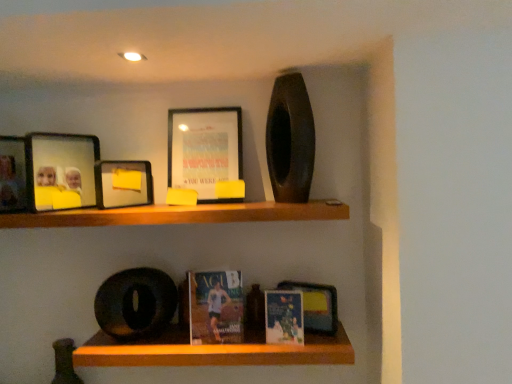
The height and width of the screenshot is (384, 512). Find the location of `vacant space in front of matte paper book at center`. vacant space in front of matte paper book at center is located at coordinates (322, 344).